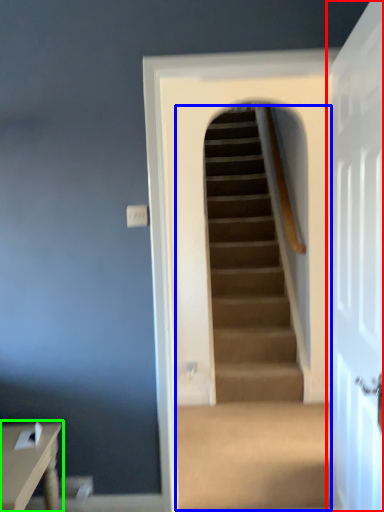
Question: Which object is positioned farthest from door (highlighted by a red box)? Select from escalator (highlighted by a blue box) and table (highlighted by a green box).

Choices:
 (A) escalator
 (B) table

Answer: (A)